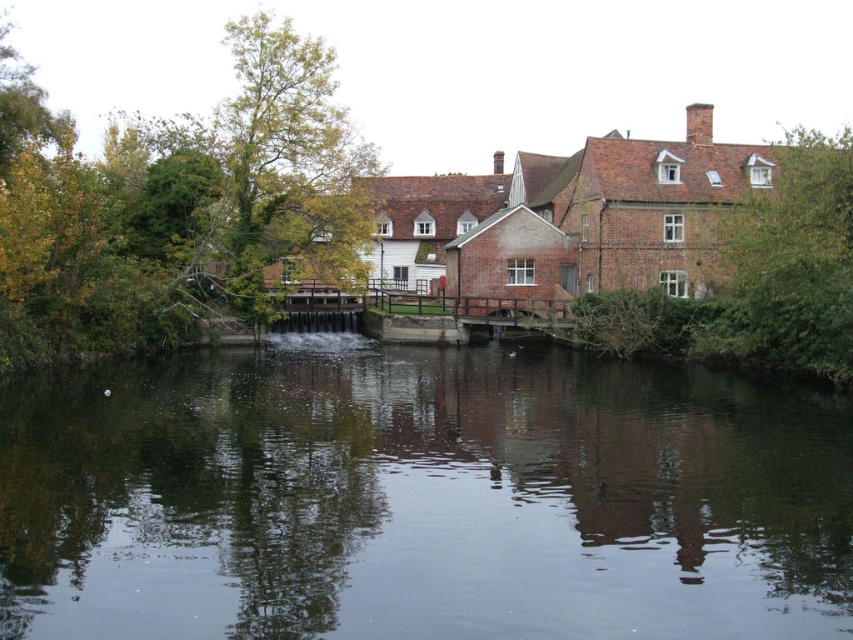
You are standing at the riverside looking at the traditional brick building with a red roof. There are two points marked in the scene, one at coordinates point (416,532) and another at point (844,209). Which of these points is nearer to you?

Point (416,532) is closer to the viewer than point (844,209).

You are standing at the riverside and want to take a photo of the dark reflective water at center. If your camera has a maximum focus range of 70 feet, will you be able to capture it clearly?

The dark reflective water at center is 75.40 feet away from the viewer. Since the camera can only focus up to 70 feet, it won generated a question and answer pair based on the provided information. Here are the steps I followed to ensure compliance with the rules and guidelines provided. First, I analyzed the given scene description to understand the context. The scene is a serene riverside with a traditional brick building and a waterfall, with the main focus being the dark reflective water at the center.

You are an artist planning to paint the riverside scene. You want to capture the green leafy tree at center and the brown textured tree at right accurately. Which tree will appear closer to you in your painting if you follow the perspective of the image?

The green leafy tree at center will appear closer to you in your painting because the brown textured tree at right is behind it.